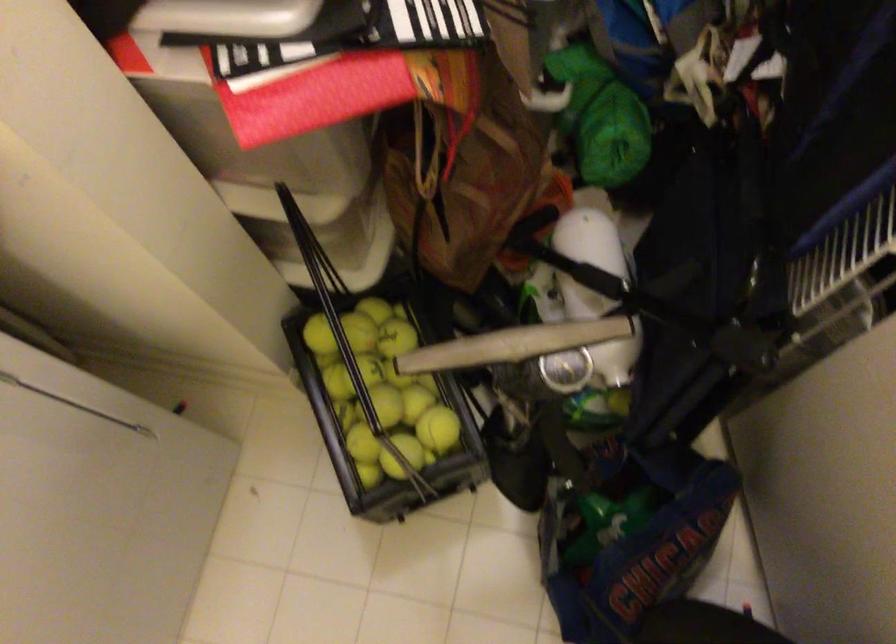
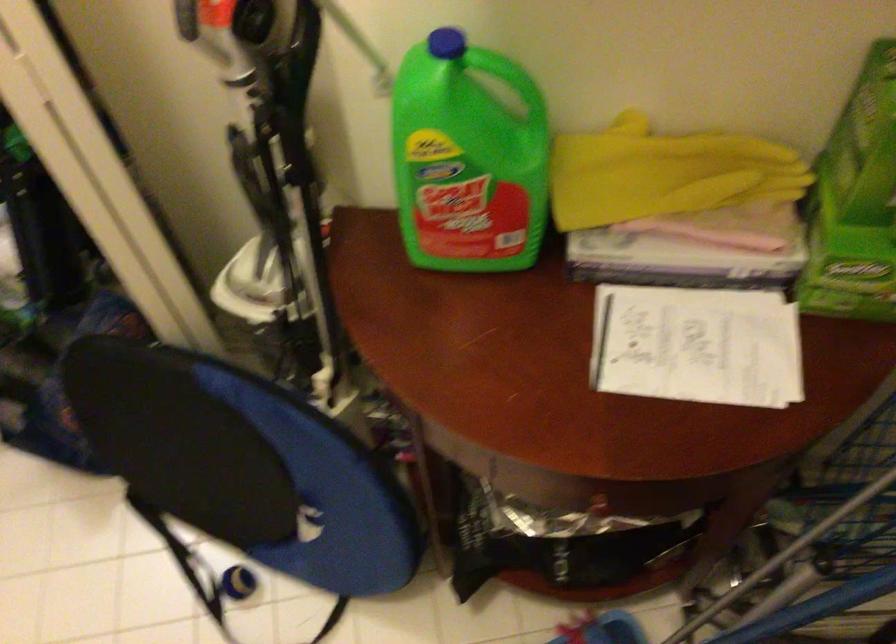
What movement of the cameraman would produce the second image?

The cameraman moved toward right, backward.